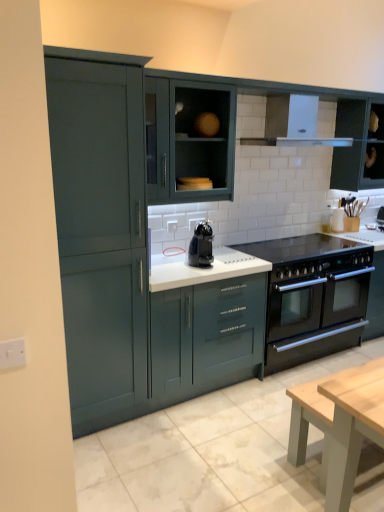
Question: In the image, is white glossy exhaust hood at upper center positioned in front of or behind matte dark green cabinet at center, arranged as the 4th cabinetry when viewed from the left?

Choices:
 (A) front
 (B) behind

Answer: (A)

Question: From the image's perspective, is white glossy exhaust hood at upper center located above or below matte dark green cabinet at center, arranged as the 4th cabinetry when viewed from the left?

Choices:
 (A) above
 (B) below

Answer: (A)

Question: Which of these objects is positioned farthest from the black glossy coffee machine at center?

Choices:
 (A) matte dark green cabinet at center, the 2th cabinetry from the right
 (B) white glossy exhaust hood at upper center
 (C) black matte oven at center-right
 (D) glossy teal cabinet at center, the third cabinetry positioned from the right
 (E) white plastic switch at left, the first electric outlet ordered from the bottom

Answer: (E)

Question: Which object is the closest to the glossy teal cabinet at center, which is the 3th cabinetry in left-to-right order?

Choices:
 (A) white plastic electric outlet at center, which ranks as the 2th electric outlet in left-to-right order
 (B) black glass gas stove at center
 (C) black glossy coffee machine at center
 (D) matte dark green cabinet at upper right, placed as the 5th cabinetry when sorted from left to right
 (E) white glossy exhaust hood at upper center

Answer: (C)